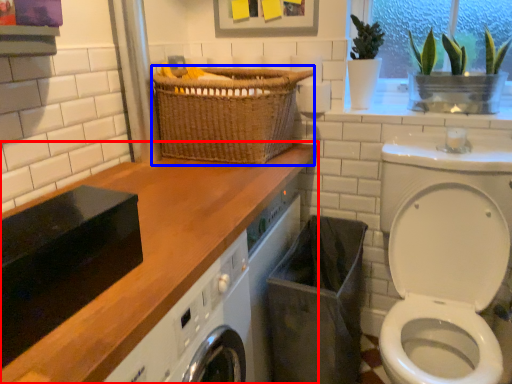
Question: Which point is closer to the camera, countertop (highlighted by a red box) or basket (highlighted by a blue box)?

Choices:
 (A) countertop
 (B) basket

Answer: (A)